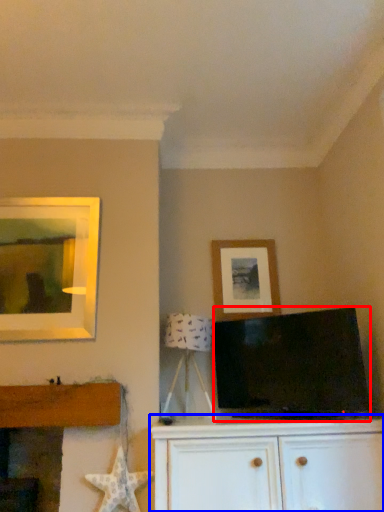
Question: Which point is closer to the camera, television (highlighted by a red box) or cabinetry (highlighted by a blue box)?

Choices:
 (A) television
 (B) cabinetry

Answer: (B)